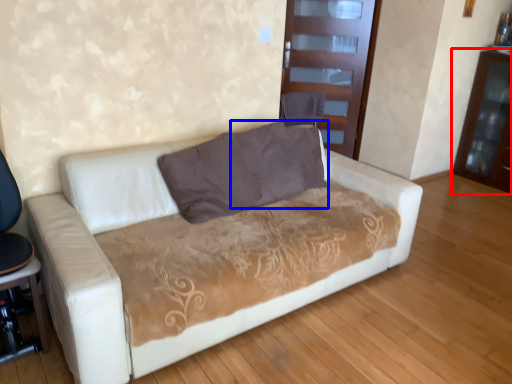
Question: Which object is further to the camera taking this photo, dresser (highlighted by a red box) or pillow (highlighted by a blue box)?

Choices:
 (A) dresser
 (B) pillow

Answer: (A)